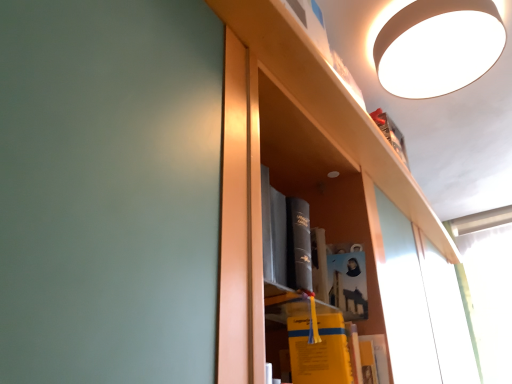
Locate an element on the screen. The height and width of the screenshot is (384, 512). white matte lampshade at upper right is located at coordinates (438, 46).

Measure the distance between point (444,91) and camera.

Point (444,91) is 1.24 meters away from camera.

In order to click on yellow matte book at center, the 1th book in the bottom-to-top sequence in this screenshot , I will do `click(319, 351)`.

Is the depth of yellow matte book at center, the 1th book in the bottom-to-top sequence, greater than that of matte paper book at center, which is the first book from top to bottom?

That is False.

Looking at this image, visually, is yellow matte book at center, which is the 2th book from top to bottom, positioned to the left or to the right of matte paper book at center, marked as the second book in a bottom-to-top arrangement?

From the image, it's evident that yellow matte book at center, which is the 2th book from top to bottom, is to the left of matte paper book at center, marked as the second book in a bottom-to-top arrangement.

Is yellow matte book at center, which is the 2th book from top to bottom, turned away from matte paper book at center, marked as the second book in a bottom-to-top arrangement?

That's not correct — yellow matte book at center, which is the 2th book from top to bottom, is not looking away from matte paper book at center, marked as the second book in a bottom-to-top arrangement.

Is yellow matte book at center, which is the 2th book from top to bottom, positioned beyond the bounds of matte paper book at center, which is the first book from top to bottom?

Absolutely, yellow matte book at center, which is the 2th book from top to bottom, is external to matte paper book at center, which is the first book from top to bottom.

Is matte paper book at center, marked as the second book in a bottom-to-top arrangement, facing away from white matte lampshade at upper right?

No, matte paper book at center, marked as the second book in a bottom-to-top arrangement, is not facing the opposite direction of white matte lampshade at upper right.

Which object is positioned more to the left, matte paper book at center, which is the first book from top to bottom, or white matte lampshade at upper right?

From the viewer's perspective, matte paper book at center, which is the first book from top to bottom, appears more on the left side.

From the image's perspective, is matte paper book at center, which is the first book from top to bottom, above white matte lampshade at upper right?

No, from the image's perspective, matte paper book at center, which is the first book from top to bottom, is not on top of white matte lampshade at upper right.

Locate an element on the screen. The width and height of the screenshot is (512, 384). the 1st book positioned below the white matte lampshade at upper right (from the image's perspective) is located at coordinates (348, 284).

Can you confirm if white matte lampshade at upper right is smaller than matte paper book at center, which is the first book from top to bottom?

Incorrect, white matte lampshade at upper right is not smaller in size than matte paper book at center, which is the first book from top to bottom.

Can you confirm if white matte lampshade at upper right is positioned to the left of matte paper book at center, marked as the second book in a bottom-to-top arrangement?

No.

Could you tell me if white matte lampshade at upper right is turned towards matte paper book at center, marked as the second book in a bottom-to-top arrangement?

No.

Measure the distance between white matte lampshade at upper right and matte paper book at center, marked as the second book in a bottom-to-top arrangement.

white matte lampshade at upper right is 23.51 inches away from matte paper book at center, marked as the second book in a bottom-to-top arrangement.

Is white matte lampshade at upper right not near yellow matte book at center, which is the 2th book from top to bottom?

No, white matte lampshade at upper right is in close proximity to yellow matte book at center, which is the 2th book from top to bottom.

Who is taller, white matte lampshade at upper right or yellow matte book at center, the 1th book in the bottom-to-top sequence?

yellow matte book at center, the 1th book in the bottom-to-top sequence, is taller.

Is white matte lampshade at upper right positioned beyond the bounds of yellow matte book at center, which is the 2th book from top to bottom?

white matte lampshade at upper right lies outside yellow matte book at center, which is the 2th book from top to bottom,'s area.

Does matte paper book at center, marked as the second book in a bottom-to-top arrangement, have a greater width compared to yellow matte book at center, the 1th book in the bottom-to-top sequence?

No, matte paper book at center, marked as the second book in a bottom-to-top arrangement, is not wider than yellow matte book at center, the 1th book in the bottom-to-top sequence.

In the image, is matte paper book at center, marked as the second book in a bottom-to-top arrangement, on the left side or the right side of yellow matte book at center, which is the 2th book from top to bottom?

matte paper book at center, marked as the second book in a bottom-to-top arrangement, is positioned on yellow matte book at center, which is the 2th book from top to bottom,'s right side.

Is matte paper book at center, marked as the second book in a bottom-to-top arrangement, aimed at yellow matte book at center, the 1th book in the bottom-to-top sequence?

No, matte paper book at center, marked as the second book in a bottom-to-top arrangement, is not turned towards yellow matte book at center, the 1th book in the bottom-to-top sequence.

From a real-world perspective, is matte paper book at center, marked as the second book in a bottom-to-top arrangement, located beneath yellow matte book at center, which is the 2th book from top to bottom?

Actually, matte paper book at center, marked as the second book in a bottom-to-top arrangement, is physically above yellow matte book at center, which is the 2th book from top to bottom, in the real world.

From a real-world perspective, is yellow matte book at center, which is the 2th book from top to bottom, located beneath white matte lampshade at upper right?

Yes, from a real-world perspective, yellow matte book at center, which is the 2th book from top to bottom, is under white matte lampshade at upper right.

Is yellow matte book at center, the 1th book in the bottom-to-top sequence, wider than white matte lampshade at upper right?

No, yellow matte book at center, the 1th book in the bottom-to-top sequence, is not wider than white matte lampshade at upper right.

Is yellow matte book at center, which is the 2th book from top to bottom, bigger than white matte lampshade at upper right?

No, yellow matte book at center, which is the 2th book from top to bottom, is not bigger than white matte lampshade at upper right.

Is point (344, 373) farther from viewer compared to point (407, 30)?

That is False.

I want to click on book above the yellow matte book at center, which is the 2th book from top to bottom (from the image's perspective), so click(x=348, y=284).

I want to click on the 1st book to the left of the white matte lampshade at upper right, counting from the anchor's position, so click(348, 284).

Considering their positions, is matte paper book at center, which is the first book from top to bottom, positioned further to white matte lampshade at upper right than yellow matte book at center, which is the 2th book from top to bottom?

yellow matte book at center, which is the 2th book from top to bottom, is further to white matte lampshade at upper right.

Considering their positions, is yellow matte book at center, which is the 2th book from top to bottom, positioned further to matte paper book at center, marked as the second book in a bottom-to-top arrangement, than white matte lampshade at upper right?

The object further to matte paper book at center, marked as the second book in a bottom-to-top arrangement, is white matte lampshade at upper right.

Looking at the image, which one is located further to matte paper book at center, which is the first book from top to bottom, white matte lampshade at upper right or yellow matte book at center, which is the 2th book from top to bottom?

white matte lampshade at upper right.

Considering their positions, is white matte lampshade at upper right positioned further to yellow matte book at center, the 1th book in the bottom-to-top sequence, than matte paper book at center, marked as the second book in a bottom-to-top arrangement?

white matte lampshade at upper right is positioned further to the anchor yellow matte book at center, the 1th book in the bottom-to-top sequence.

Which object lies further to the anchor point white matte lampshade at upper right, yellow matte book at center, which is the 2th book from top to bottom, or matte paper book at center, which is the first book from top to bottom?

Among the two, yellow matte book at center, which is the 2th book from top to bottom, is located further to white matte lampshade at upper right.

When comparing their distances from yellow matte book at center, which is the 2th book from top to bottom, does matte paper book at center, marked as the second book in a bottom-to-top arrangement, or white matte lampshade at upper right seem further?

white matte lampshade at upper right.

This screenshot has width=512, height=384. In order to click on book that lies between white matte lampshade at upper right and yellow matte book at center, which is the 2th book from top to bottom, from top to bottom in this screenshot , I will do `click(348, 284)`.